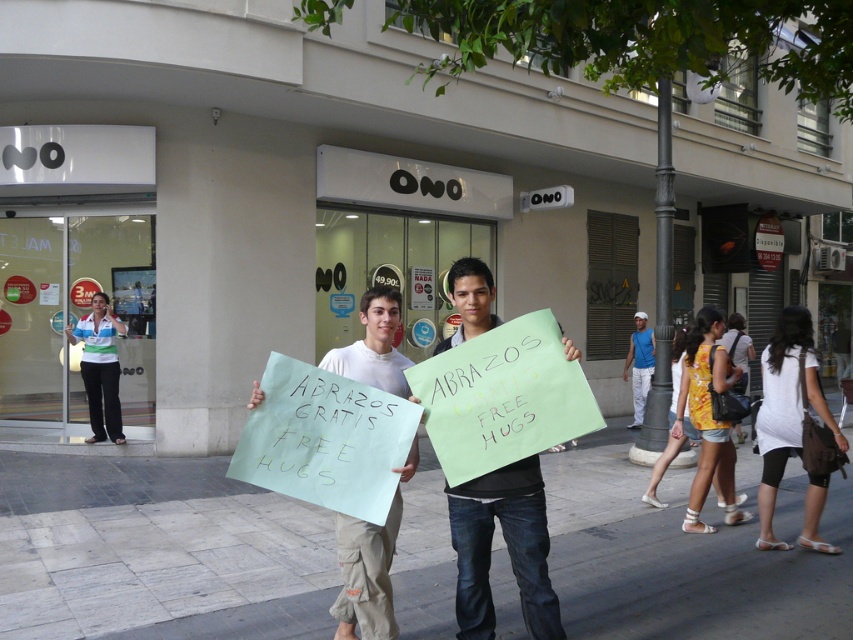
You are a fashion designer observing the street scene outside the ONO store. You notice two individuals wearing a white fabric shirt at center and a blue sleeveless shirt at right. Which shirt do you think has a larger width measurement?

The white fabric shirt at center might be wider than blue sleeveless shirt at right according to the description.

You are a pedestrian walking towards the store entrance. Which object, the gray concrete pavement at center or the blue sleeveless shirt at right, will you encounter first?

The gray concrete pavement at center is closer to the viewer than the blue sleeveless shirt at right, so you will encounter the gray concrete pavement at center first.